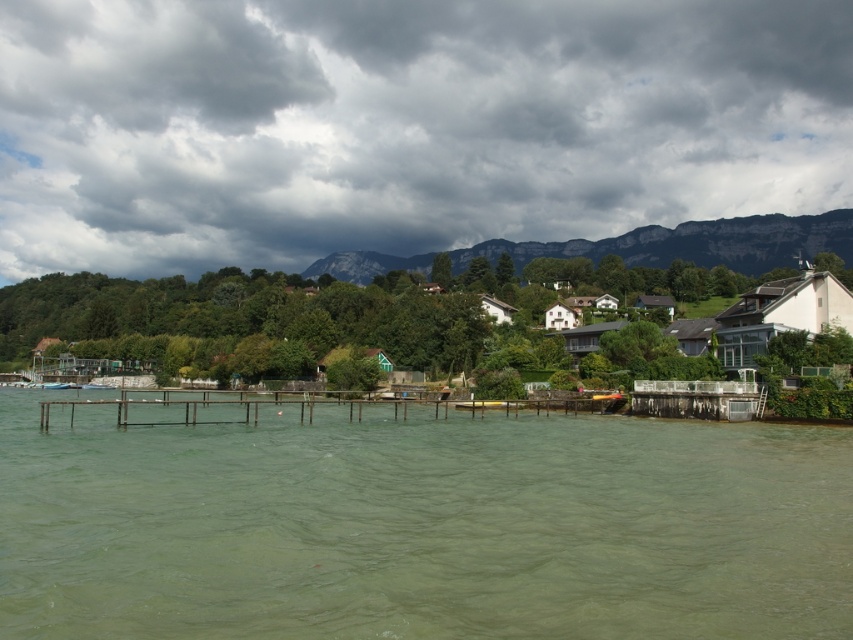
Question: Based on their relative distances, which object is nearer to the green murky water at center?

Choices:
 (A) brown wooden dock at center
 (B) rugged stone mountain at upper center

Answer: (A)

Question: Which of these objects is positioned closest to the green murky water at center?

Choices:
 (A) rugged stone mountain at upper center
 (B) cloudy sky at upper center

Answer: (A)

Question: Does cloudy sky at upper center appear over rugged stone mountain at upper center?

Choices:
 (A) yes
 (B) no

Answer: (A)

Question: Is cloudy sky at upper center to the left of green murky water at center from the viewer's perspective?

Choices:
 (A) yes
 (B) no

Answer: (A)

Question: Which of these objects is positioned farthest from the cloudy sky at upper center?

Choices:
 (A) rugged stone mountain at upper center
 (B) brown wooden dock at center
 (C) green murky water at center

Answer: (C)

Question: Can you confirm if cloudy sky at upper center is positioned above green murky water at center?

Choices:
 (A) yes
 (B) no

Answer: (A)